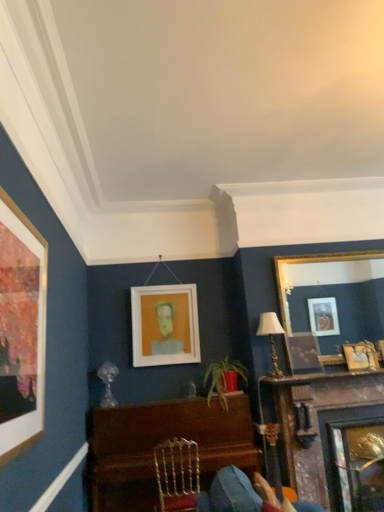
Question: Is gold/gilded mirror at upper right, the 3th picture frame in the left-to-right sequence, oriented away from matte gold picture frame at upper right, the fourth picture frame viewed from the left?

Choices:
 (A) no
 (B) yes

Answer: (B)

Question: Can you confirm if gold/gilded mirror at upper right, the 2th picture frame from the right, is shorter than matte gold picture frame at upper right, the fourth picture frame viewed from the left?

Choices:
 (A) yes
 (B) no

Answer: (B)

Question: Considering the relative sizes of gold/gilded mirror at upper right, the 3th picture frame in the left-to-right sequence, and matte gold picture frame at upper right, the fourth picture frame viewed from the left, in the image provided, is gold/gilded mirror at upper right, the 3th picture frame in the left-to-right sequence, smaller than matte gold picture frame at upper right, the fourth picture frame viewed from the left,?

Choices:
 (A) no
 (B) yes

Answer: (A)

Question: From the image's perspective, is gold/gilded mirror at upper right, the 2th picture frame from the right, under matte gold picture frame at upper right, marked as the 1th picture frame in a right-to-left arrangement?

Choices:
 (A) yes
 (B) no

Answer: (B)

Question: Is gold/gilded mirror at upper right, the 3th picture frame in the left-to-right sequence, at the left side of matte gold picture frame at upper right, the fourth picture frame viewed from the left?

Choices:
 (A) yes
 (B) no

Answer: (A)

Question: Is matte gold lampshade at upper right bigger or smaller than gold/gilded mirror at upper right, the 2th picture frame from the right?

Choices:
 (A) big
 (B) small

Answer: (B)

Question: From a real-world perspective, relative to gold/gilded mirror at upper right, the 2th picture frame from the right, is matte gold lampshade at upper right vertically above or below?

Choices:
 (A) above
 (B) below

Answer: (B)

Question: Based on their positions, is matte gold lampshade at upper right located to the left or right of gold/gilded mirror at upper right, the 2th picture frame from the right?

Choices:
 (A) left
 (B) right

Answer: (A)

Question: Considering the positions of matte gold lampshade at upper right and gold/gilded mirror at upper right, the 3th picture frame in the left-to-right sequence, in the image, is matte gold lampshade at upper right wider or thinner than gold/gilded mirror at upper right, the 3th picture frame in the left-to-right sequence,?

Choices:
 (A) thin
 (B) wide

Answer: (B)

Question: In the image, is gold metallic chair at center positioned in front of or behind polished wood piano at center?

Choices:
 (A) front
 (B) behind

Answer: (A)

Question: From their relative heights in the image, would you say gold metallic chair at center is taller or shorter than polished wood piano at center?

Choices:
 (A) tall
 (B) short

Answer: (B)

Question: Is gold metallic chair at center bigger or smaller than polished wood piano at center?

Choices:
 (A) small
 (B) big

Answer: (A)

Question: Is point (192, 453) positioned closer to the camera than point (188, 404)?

Choices:
 (A) closer
 (B) farther

Answer: (A)

Question: From a real-world perspective, is matte gold picture frame at upper right, marked as the 1th picture frame in a right-to-left arrangement, physically located above or below matte gold lampshade at upper right?

Choices:
 (A) above
 (B) below

Answer: (B)

Question: Does point tap(359, 342) appear closer or farther from the camera than point tap(271, 348)?

Choices:
 (A) closer
 (B) farther

Answer: (B)